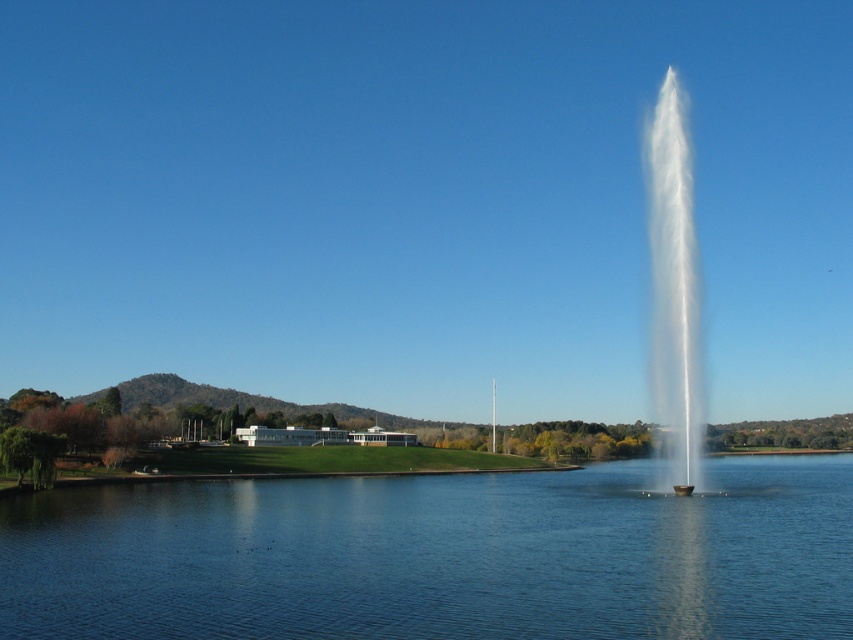
Question: Is clear blue water at center smaller than white frothy water at right?

Choices:
 (A) no
 (B) yes

Answer: (B)

Question: Which object is closer to the camera taking this photo?

Choices:
 (A) white frothy water at right
 (B) clear blue water at center

Answer: (B)

Question: Which point appears farthest from the camera in this image?

Choices:
 (A) (258, 616)
 (B) (689, 310)

Answer: (B)

Question: Among these points, which one is farthest from the camera?

Choices:
 (A) (701, 412)
 (B) (146, 524)

Answer: (A)

Question: Can you confirm if clear blue water at center is positioned to the right of white frothy water at right?

Choices:
 (A) no
 (B) yes

Answer: (A)

Question: Can you confirm if clear blue water at center is thinner than white frothy water at right?

Choices:
 (A) yes
 (B) no

Answer: (A)